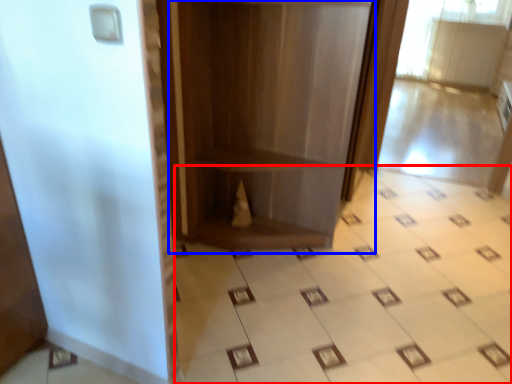
Question: Which object appears farthest to the camera in this image, ceramic tile (highlighted by a red box) or bookshelf (highlighted by a blue box)?

Choices:
 (A) ceramic tile
 (B) bookshelf

Answer: (B)